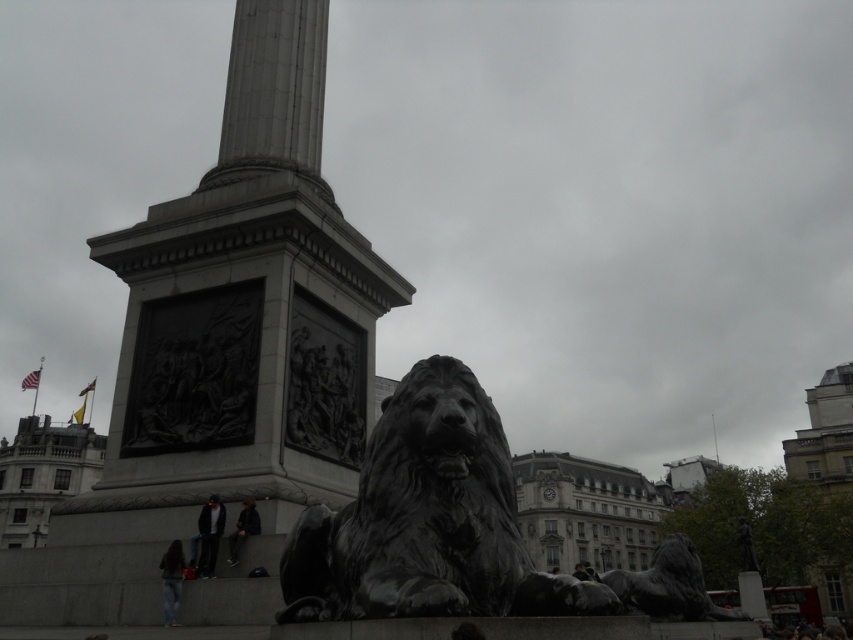
Question: Does dark gray suit at lower left appear over dark gray jacket at lower center?

Choices:
 (A) no
 (B) yes

Answer: (A)

Question: Is dark gray suit at lower left to the left of dark gray jacket at lower center from the viewer's perspective?

Choices:
 (A) no
 (B) yes

Answer: (B)

Question: Is black polished stone lion at center smaller than dark gray suit at lower left?

Choices:
 (A) yes
 (B) no

Answer: (B)

Question: Based on their relative distances, which object is farther from the dark gray jeans at lower left?

Choices:
 (A) dark gray jacket at lower center
 (B) dark gray suit at lower left
 (C) black polished stone lion at center

Answer: (C)

Question: Which point is farther to the camera?

Choices:
 (A) (172, 561)
 (B) (247, 504)

Answer: (B)

Question: Which object is positioned farthest from the dark gray suit at lower left?

Choices:
 (A) dark gray jacket at lower center
 (B) black polished stone lion at center

Answer: (B)